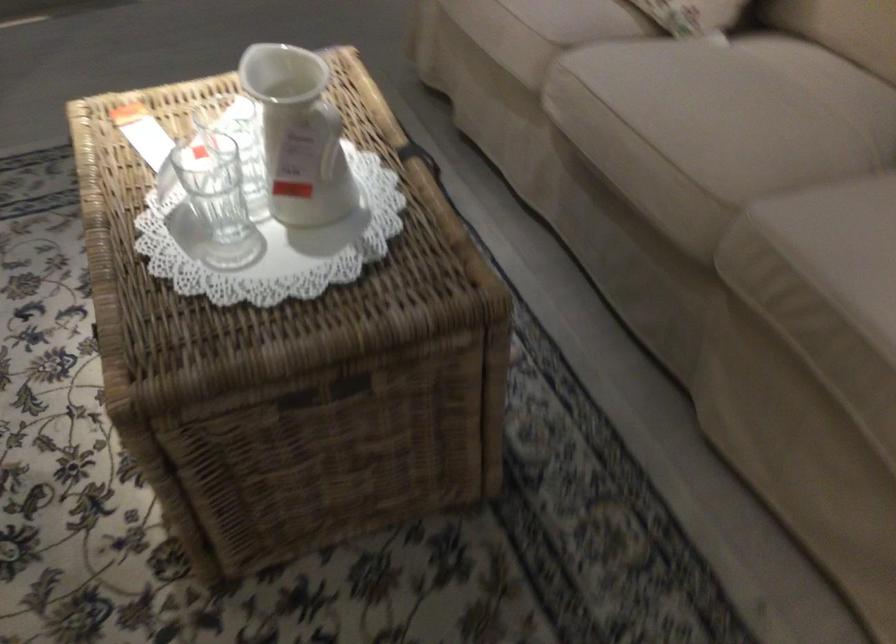
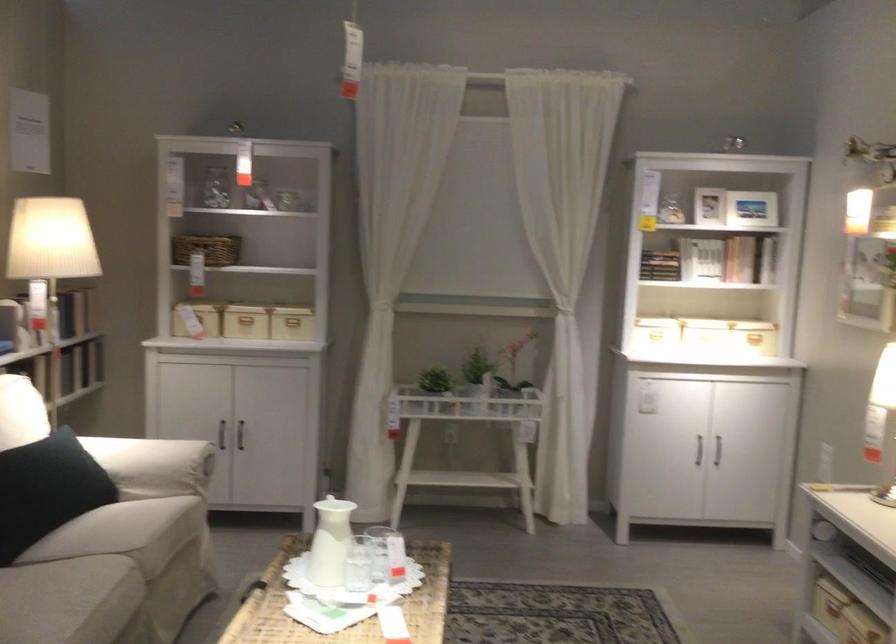
Where in the second image is the point corresponding to (719,163) from the first image?

(110, 576)